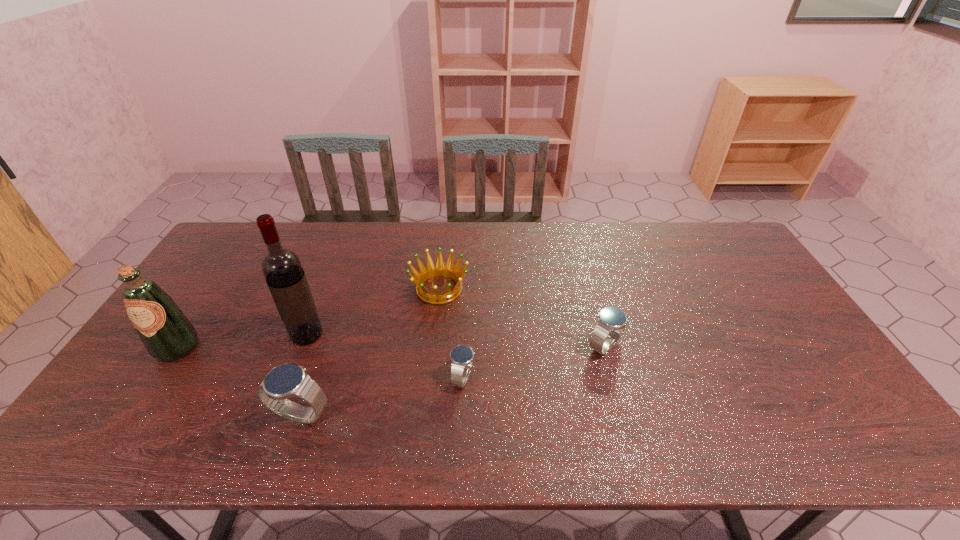
Locate an element on the screen. The image size is (960, 540). free space at the far left corner of the desktop is located at coordinates (245, 262).

Identify the location of empty space between the second tallest watch and the leftmost object. This screenshot has width=960, height=540. (391, 347).

The image size is (960, 540). I want to click on unoccupied area between the rightmost watch and the shortest watch, so click(534, 362).

This screenshot has height=540, width=960. What are the coordinates of `vacant region between the shortest watch and the third shortest object` in the screenshot? It's located at (534, 362).

At what (x,y) coordinates should I click in order to perform the action: click on free space between the second watch from right to left and the leftmost watch. Please return your answer as a coordinate pair (x, y). This screenshot has height=540, width=960. Looking at the image, I should click on (382, 396).

This screenshot has width=960, height=540. What are the coordinates of `free space between the third shortest object and the olive oil` in the screenshot? It's located at (391, 347).

Identify the location of empty location between the shortest watch and the second tallest watch. The image size is (960, 540). (534, 362).

The image size is (960, 540). In order to click on free space between the rightmost object and the farthest object in this screenshot , I will do `click(522, 318)`.

Locate an element on the screen. vacant space in between the farthest object and the fourth tallest object is located at coordinates (522, 318).

Select which object appears as the closest to the second watch from right to left. Please provide its 2D coordinates. Your answer should be formatted as a tuple, i.e. [(x, y)], where the tuple contains the x and y coordinates of a point satisfying the conditions above.

[(440, 270)]